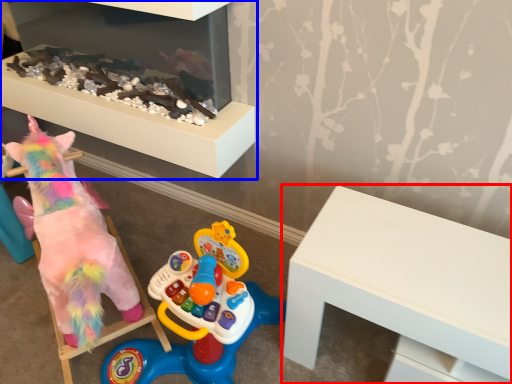
Question: Which point is further to the camera, table (highlighted by a red box) or furniture (highlighted by a blue box)?

Choices:
 (A) table
 (B) furniture

Answer: (B)